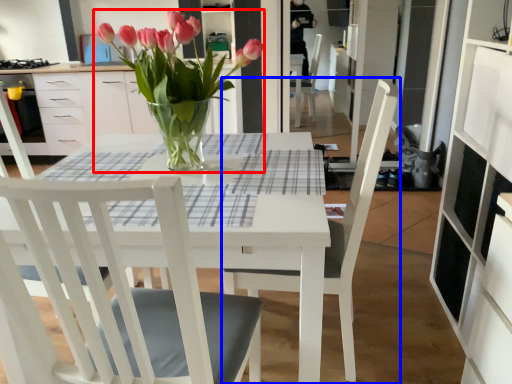
Question: Which object appears closest to the camera in this image, houseplant (highlighted by a red box) or chair (highlighted by a blue box)?

Choices:
 (A) houseplant
 (B) chair

Answer: (B)